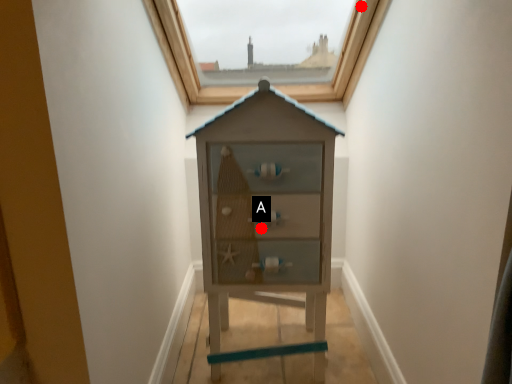
Question: Two points are circled on the image, labeled by A and B beside each circle. Which point is farther to the camera?

Choices:
 (A) A is further
 (B) B is further

Answer: (B)